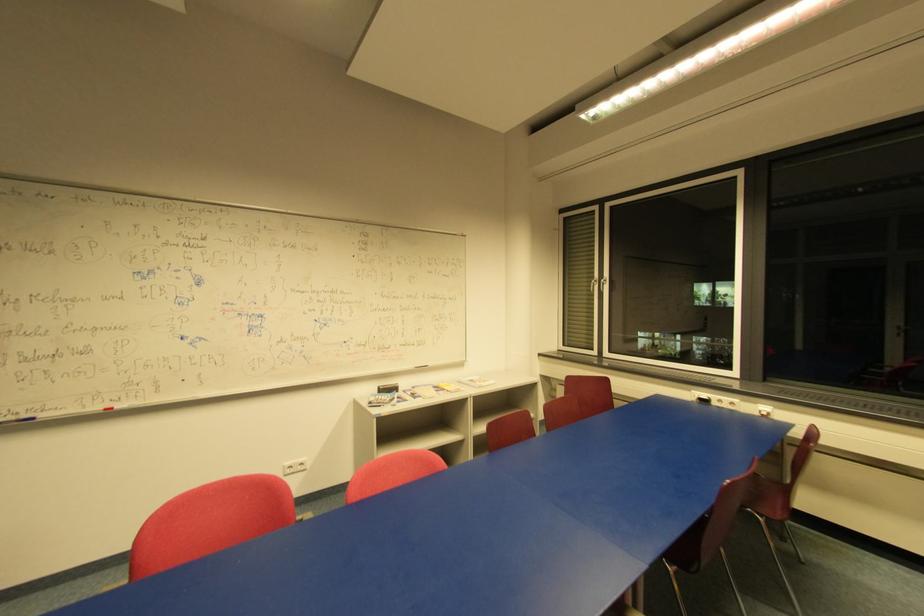
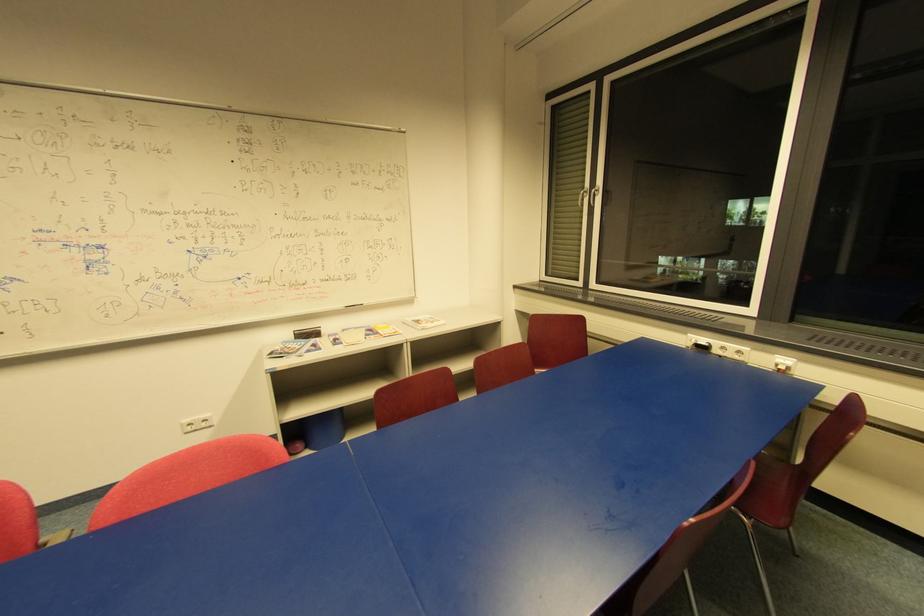
Question: How did the camera likely rotate?

Choices:
 (A) Left
 (B) Right
 (C) Up
 (D) Down

Answer: (D)